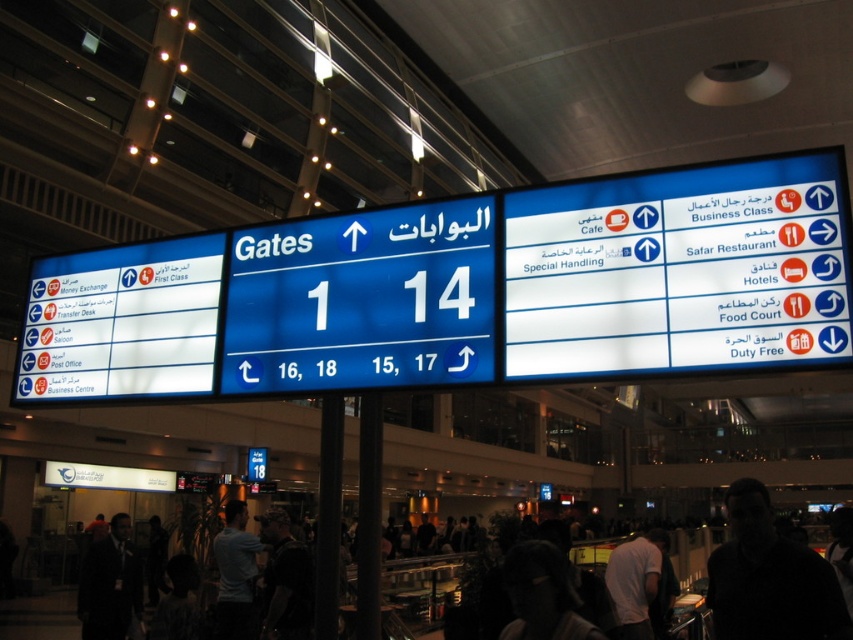
Which is more to the right, blue glossy signboard at center or blue glossy sign at center?

blue glossy sign at center

Where is `blue glossy signboard at center`? blue glossy signboard at center is located at coordinates (463, 291).

Is blue glossy sign at center above dark skin face at center?

Yes.

Who is positioned more to the left, blue glossy sign at center or dark skin face at center?

blue glossy sign at center is more to the left.

Find the location of a particular element. blue glossy sign at center is located at coordinates (363, 300).

The width and height of the screenshot is (853, 640). In order to click on blue glossy sign at center in this screenshot , I will do `click(363, 300)`.

Can you confirm if dark fabric person at center is positioned below dark gray sweater at center?

Actually, dark fabric person at center is above dark gray sweater at center.

Which of these two, dark fabric person at center or dark gray sweater at center, stands shorter?

With less height is dark fabric person at center.

Locate an element on the screen. dark fabric person at center is located at coordinates (285, 580).